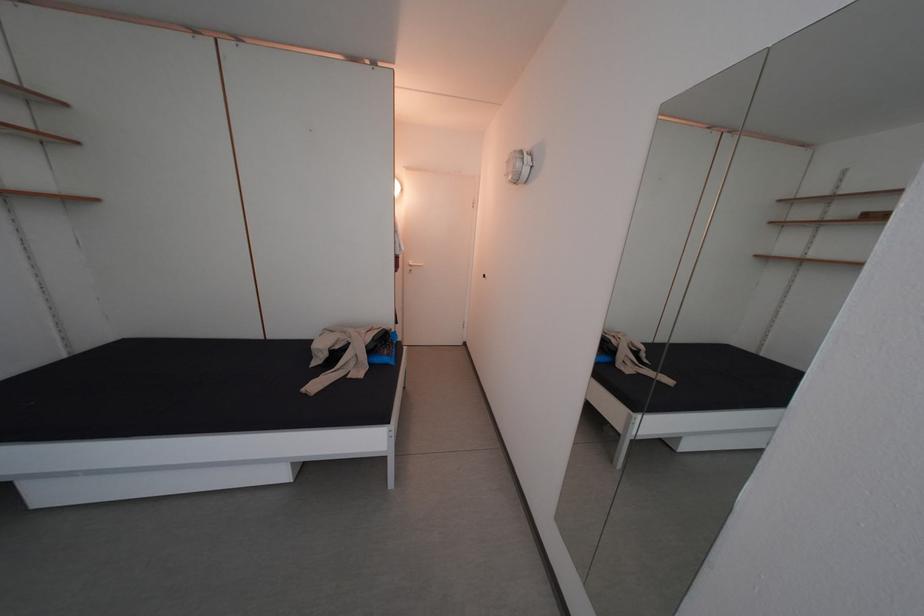
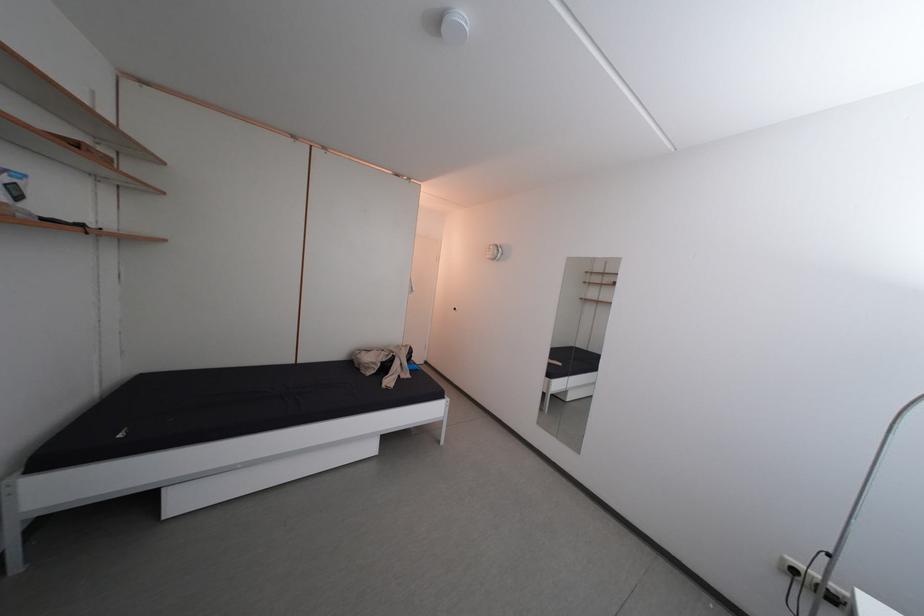
Which direction would the cameraman need to move to produce the second image?

The movement direction of the cameraman is left, backward.